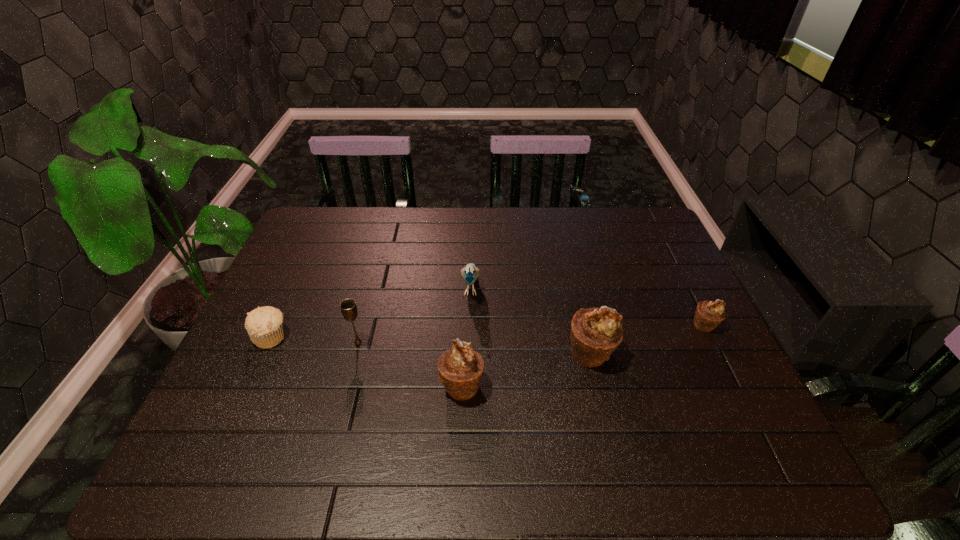
Locate an element on the screen. This screenshot has width=960, height=540. vacant place for an extra muffin on the left is located at coordinates (314, 422).